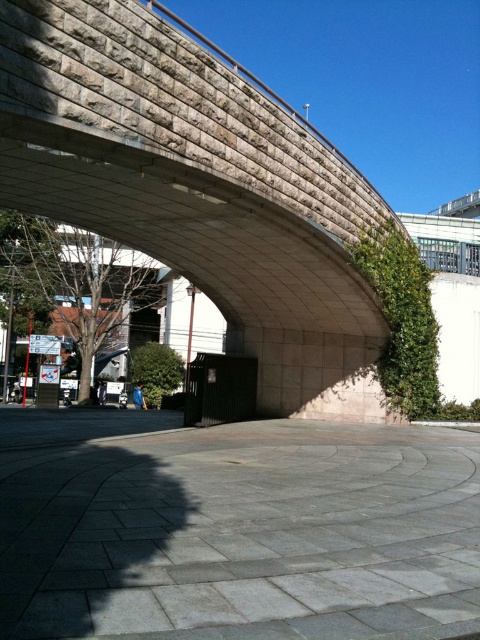
You are standing on the gray concrete pavement at center and want to cross to the other side of the stone textured bridge at center. Which direction should you walk to reach the bridge first?

You should walk towards the stone textured bridge at center because the gray concrete pavement at center is in front of it, meaning the bridge is directly ahead.

You are a delivery person trying to determine the best path to deliver packages efficiently. You have two options to choose from the gray concrete pavement at center and the stone textured bridge at center. Which path would be higher and thus potentially offer a better view for navigation?

The stone textured bridge at center has a greater height than the gray concrete pavement at center, so choosing the stone textured bridge at center would provide a higher elevation and better view for navigation.

You are a skateboarder planning to perform a trick on the gray concrete pavement at center and the stone textured bridge at center. Which surface would be more suitable for a smooth ride?

The gray concrete pavement at center is more suitable for a smooth ride because it has a flat surface, while the stone textured bridge at center has a rough surface with rectangular stones that could cause vibrations or instability during the trick.